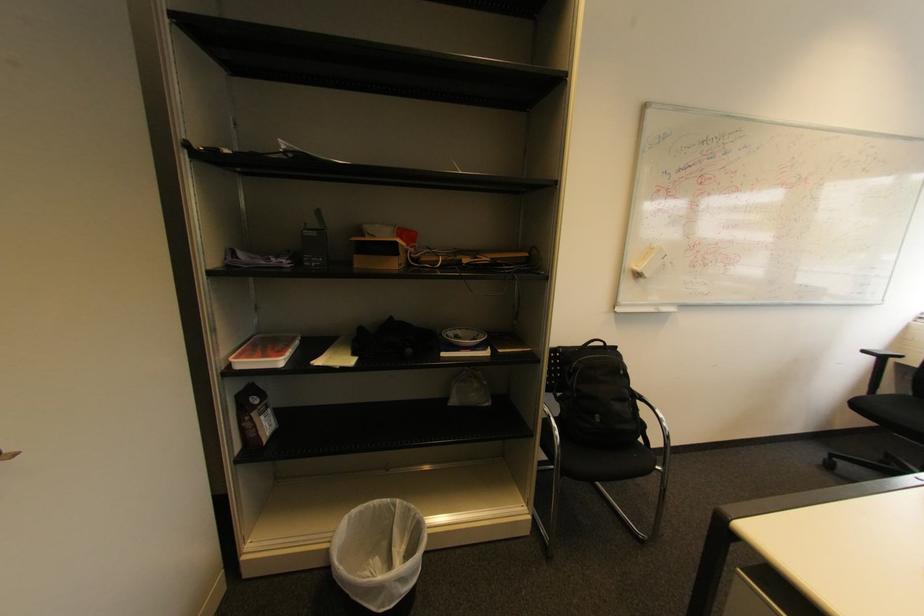
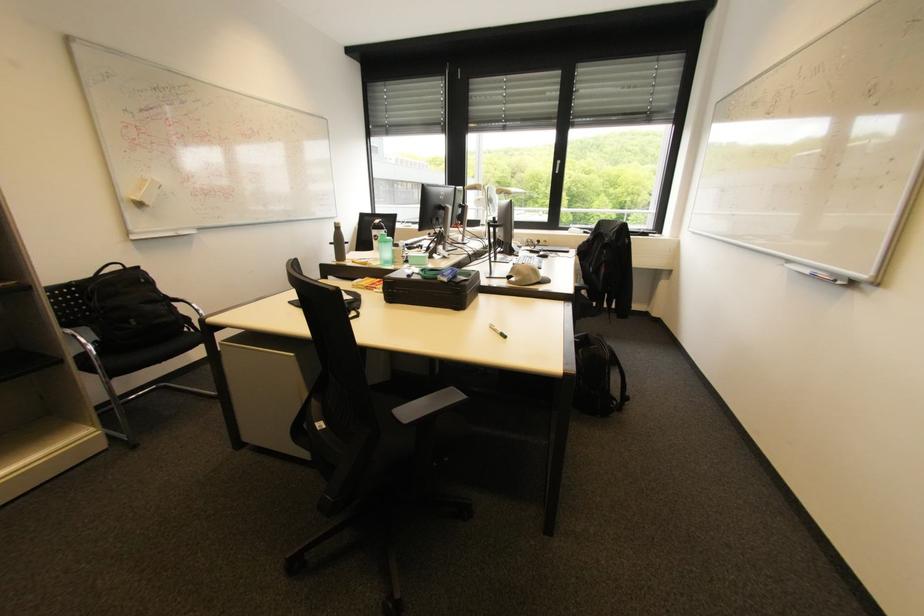
Find the pixel in the second image that matches (x=553, y=411) in the first image.

(74, 331)